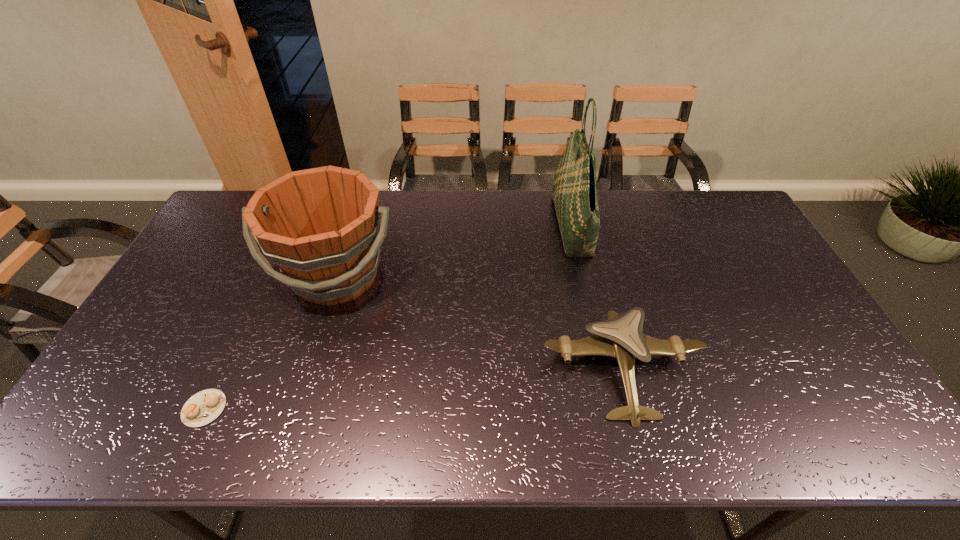
Find the location of `vacant area at the far edge`. vacant area at the far edge is located at coordinates (608, 208).

This screenshot has height=540, width=960. In the image, there is a desktop. In order to click on vacant area at the near edge in this screenshot , I will do `click(580, 419)`.

In the image, there is a desktop. At what (x,y) coordinates should I click in order to perform the action: click on free space at the left edge. Please return your answer as a coordinate pair (x, y). This screenshot has height=540, width=960. Looking at the image, I should click on (162, 342).

Identify the location of vacant space at the right edge. (731, 275).

This screenshot has height=540, width=960. Find the location of `free space between the third shortest object and the tallest object`. free space between the third shortest object and the tallest object is located at coordinates (454, 251).

Locate an element on the screen. This screenshot has height=540, width=960. blank region between the tallest object and the bucket is located at coordinates (454, 251).

Where is `empty location between the shortest object and the bucket`? This screenshot has width=960, height=540. empty location between the shortest object and the bucket is located at coordinates (271, 342).

Find the location of a particular element. empty location between the tote bag and the third tallest object is located at coordinates (596, 298).

I want to click on unoccupied position between the bucket and the third tallest object, so click(479, 322).

Where is `free space between the bucket and the cappuccino`? Image resolution: width=960 pixels, height=540 pixels. free space between the bucket and the cappuccino is located at coordinates (271, 342).